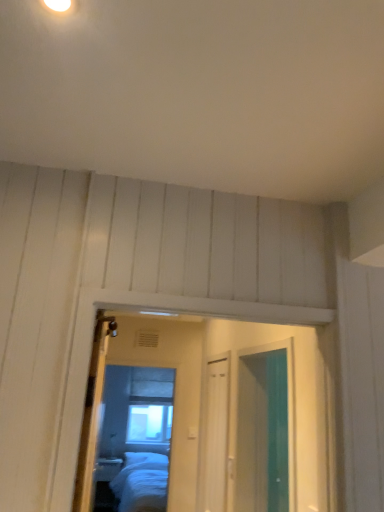
Image resolution: width=384 pixels, height=512 pixels. Describe the element at coordinates (92, 415) in the screenshot. I see `wooden door at center` at that location.

You are a GUI agent. You are given a task and a screenshot of the screen. Output one action in this format:
    pyautogui.click(x=<x>, y=<y>)
    Task: Click on the clear glass window at center
    This screenshot has height=512, width=384.
    Given the screenshot: What is the action you would take?
    pyautogui.click(x=149, y=423)

The height and width of the screenshot is (512, 384). What are the coordinates of `matte glass mirror at center` in the screenshot? It's located at (135, 434).

The image size is (384, 512). I want to click on mirror directly beneath the wooden door at center (from a real-world perspective), so click(x=135, y=434).

Is matte glass mirror at center far from wooden door at center?

Yes, matte glass mirror at center and wooden door at center are quite far apart.

What's the angular difference between matte glass mirror at center and wooden door at center's facing directions?

90.7 degrees separate the facing orientations of matte glass mirror at center and wooden door at center.

Is the position of matte glass mirror at center more distant than that of wooden door at center?

Yes, matte glass mirror at center is behind wooden door at center.

Which of these two, clear glass window at center or wooden door at center, is wider?

With larger width is wooden door at center.

Do you think clear glass window at center is within wooden door at center, or outside of it?

clear glass window at center is not inside wooden door at center, it's outside.

Which is behind, clear glass window at center or wooden door at center?

clear glass window at center is further away from the camera.

Find the location of a particular element. door that is in front of the clear glass window at center is located at coordinates point(92,415).

Does wooden door at center turn towards clear glass window at center?

No, wooden door at center is not aimed at clear glass window at center.

The height and width of the screenshot is (512, 384). What are the coordinates of `door that is on the right side of clear glass window at center` in the screenshot? It's located at (92, 415).

Is wooden door at center wider or thinner than clear glass window at center?

Considering their sizes, wooden door at center looks broader than clear glass window at center.

From their relative heights in the image, would you say wooden door at center is taller or shorter than clear glass window at center?

In the image, wooden door at center appears to be shorter than clear glass window at center.

From the image's perspective, between matte glass mirror at center and clear glass window at center, which one is located above?

matte glass mirror at center, from the image's perspective.

Can we say matte glass mirror at center lies outside clear glass window at center?

That's correct, matte glass mirror at center is outside of clear glass window at center.

Can you confirm if clear glass window at center is shorter than matte glass mirror at center?

Yes.

Which point is more forward, (161, 441) or (99, 469)?

The point (99, 469) is in front.

Considering the sizes of objects clear glass window at center and matte glass mirror at center in the image provided, who is smaller, clear glass window at center or matte glass mirror at center?

matte glass mirror at center.

Is clear glass window at center facing away from matte glass mirror at center?

No, clear glass window at center's orientation is not away from matte glass mirror at center.

Can you confirm if wooden door at center is shorter than matte glass mirror at center?

Indeed, wooden door at center has a lesser height compared to matte glass mirror at center.

From a real-world perspective, who is located higher, wooden door at center or matte glass mirror at center?

wooden door at center, from a real-world perspective.

Is wooden door at center bigger or smaller than matte glass mirror at center?

Considering their sizes, wooden door at center takes up more space than matte glass mirror at center.

Is wooden door at center not near matte glass mirror at center?

Yes, wooden door at center and matte glass mirror at center are quite far apart.

Where is `mirror located underneath the wooden door at center (from a real-world perspective)`? This screenshot has width=384, height=512. mirror located underneath the wooden door at center (from a real-world perspective) is located at coordinates (135, 434).

I want to click on door above the clear glass window at center (from a real-world perspective), so click(92, 415).

Considering their positions, is clear glass window at center positioned closer to wooden door at center than matte glass mirror at center?

matte glass mirror at center is positioned closer to the anchor wooden door at center.

Based on their spatial positions, is wooden door at center or clear glass window at center further from matte glass mirror at center?

Among the two, wooden door at center is located further to matte glass mirror at center.

Looking at the image, which one is located further to clear glass window at center, wooden door at center or matte glass mirror at center?

Among the two, wooden door at center is located further to clear glass window at center.

Which object lies further to the anchor point matte glass mirror at center, clear glass window at center or wooden door at center?

wooden door at center is positioned further to the anchor matte glass mirror at center.

From the image, which object appears to be farther from clear glass window at center, matte glass mirror at center or wooden door at center?

wooden door at center is positioned further to the anchor clear glass window at center.

When comparing their distances from wooden door at center, does matte glass mirror at center or clear glass window at center seem further?

Among the two, clear glass window at center is located further to wooden door at center.

The image size is (384, 512). Identify the location of mirror located between wooden door at center and clear glass window at center in the depth direction. pos(135,434).